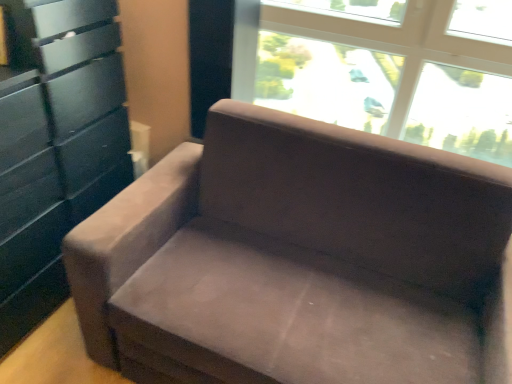
Question: Is matte black dresser at left in front of or behind suede couch at center in the image?

Choices:
 (A) front
 (B) behind

Answer: (B)

Question: Would you say matte black dresser at left is inside or outside suede couch at center?

Choices:
 (A) outside
 (B) inside

Answer: (A)

Question: Estimate the real-world distances between objects in this image. Which object is closer to the matte black dresser at left?

Choices:
 (A) transparent glass window at upper center
 (B) suede couch at center

Answer: (B)

Question: Estimate the real-world distances between objects in this image. Which object is farther from the transparent glass window at upper center?

Choices:
 (A) matte black dresser at left
 (B) suede couch at center

Answer: (A)